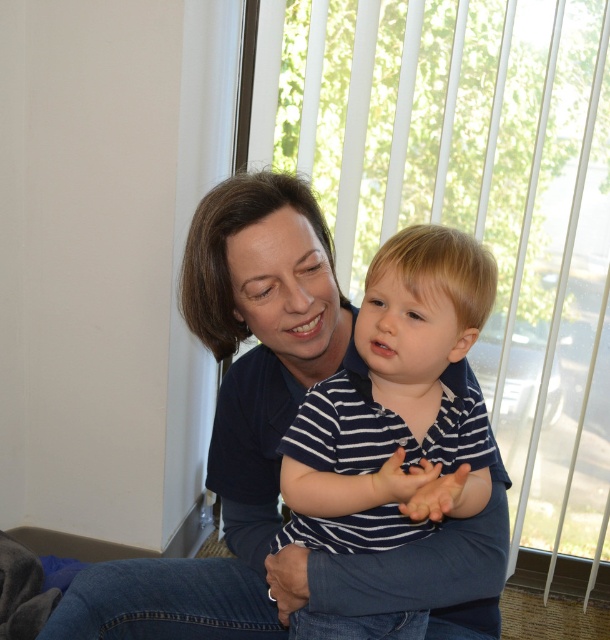
Can you confirm if matte blue shirt at center is positioned to the left of striped cotton shirt at center?

Indeed, matte blue shirt at center is positioned on the left side of striped cotton shirt at center.

In the scene shown: Who is lower down, matte blue shirt at center or striped cotton shirt at center?

Positioned lower is striped cotton shirt at center.

I want to click on matte blue shirt at center, so click(278, 452).